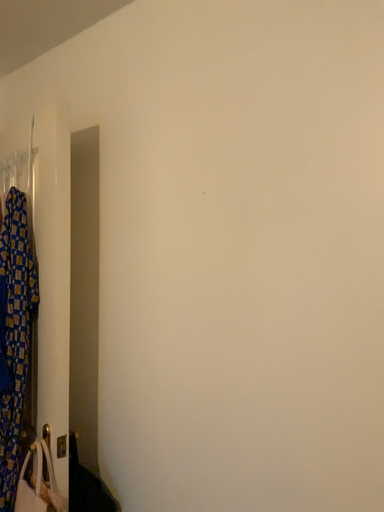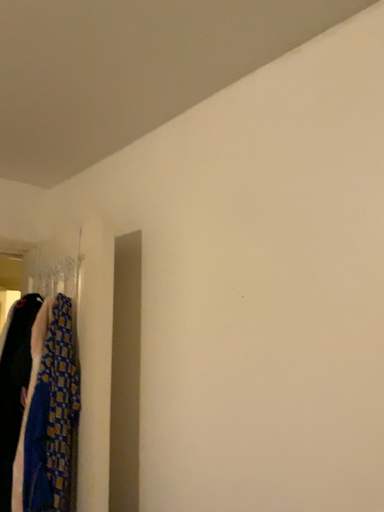
Question: How did the camera likely rotate when shooting the video?

Choices:
 (A) rotated upward
 (B) rotated downward

Answer: (A)